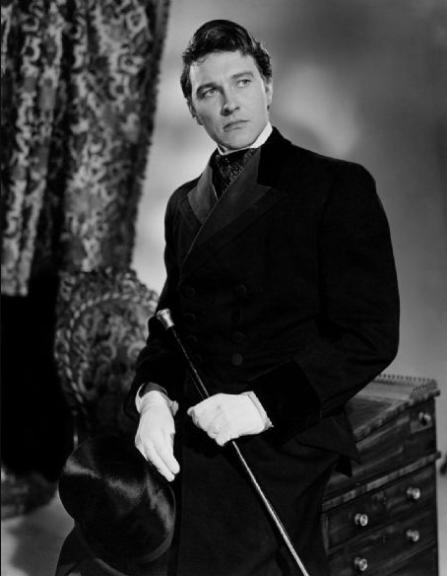
You are a GUI agent. You are given a task and a screenshot of the screen. Output one action in this format:
    pyautogui.click(x=<x>, y=<y>)
    Task: Click on the light spots on wall
    This screenshot has width=447, height=576.
    Given the screenshot: What is the action you would take?
    pyautogui.click(x=318, y=105), pyautogui.click(x=168, y=96), pyautogui.click(x=170, y=170), pyautogui.click(x=150, y=221)